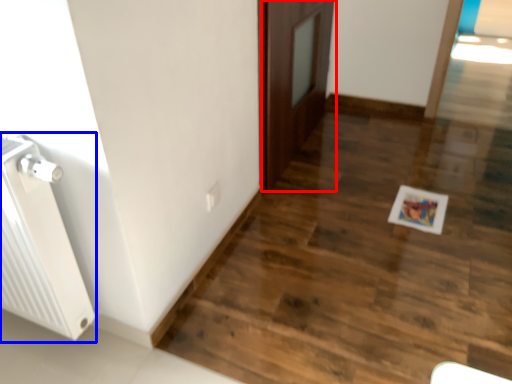
Question: Among these objects, which one is farthest to the camera, door (highlighted by a red box) or radiator (highlighted by a blue box)?

Choices:
 (A) door
 (B) radiator

Answer: (A)